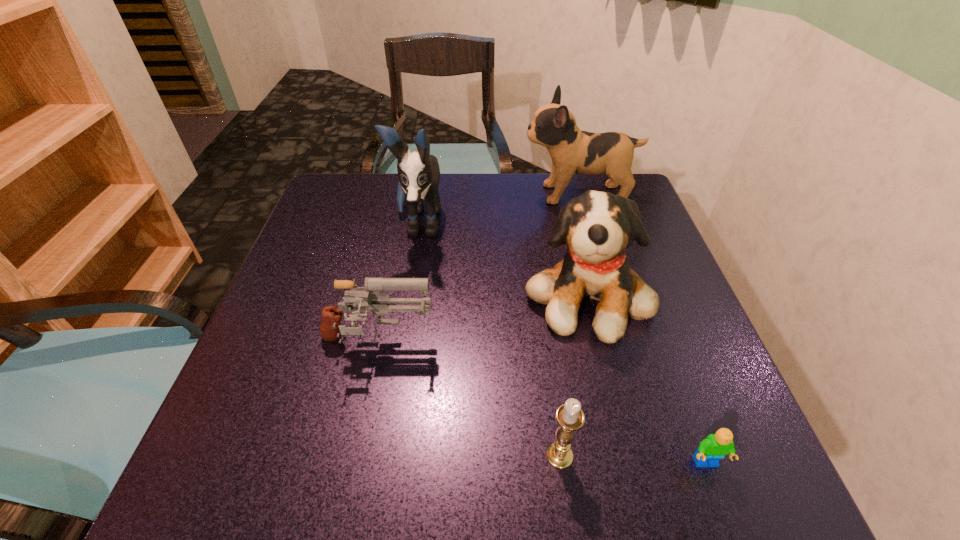
Locate an element on the screen. The height and width of the screenshot is (540, 960). the leftmost puppy is located at coordinates (419, 174).

Identify the location of the fourth shortest object. (597, 227).

The image size is (960, 540). What are the coordinates of `gun` in the screenshot? It's located at pos(369,299).

Where is `candle holder`? This screenshot has height=540, width=960. candle holder is located at coordinates (569, 416).

This screenshot has width=960, height=540. Identify the location of the shortest object. (713, 448).

You are a GUI agent. You are given a task and a screenshot of the screen. Output one action in this format:
    pyautogui.click(x=<x>, y=<y>)
    Task: Click on the vacant area located 0.100m on the front-facing side of the leftmost puppy
    The image size is (960, 540).
    Given the screenshot: What is the action you would take?
    pyautogui.click(x=408, y=292)

I want to click on free space located 0.170m at the face of the fourth shortest object, so click(621, 433).

Where is `vacant region located at the barrel end of the gun`? The width and height of the screenshot is (960, 540). vacant region located at the barrel end of the gun is located at coordinates (512, 343).

At what (x,y) coordinates should I click in order to perform the action: click on blank area located 0.220m on the right of the candle holder. Please return your answer as a coordinate pair (x, y). The image size is (960, 540). Looking at the image, I should click on (714, 456).

Find the location of a particular element. candle holder present at the near edge is located at coordinates (569, 416).